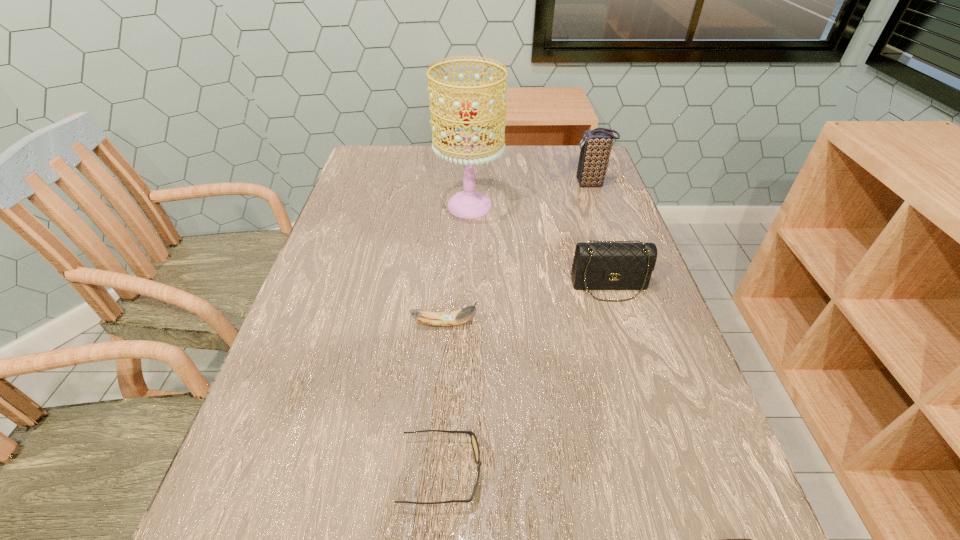
Identify which object is the fifth closest to the alarm clock. Please provide its 2D coordinates. Your answer should be formatted as a tuple, i.e. [(x, y)], where the tuple contains the x and y coordinates of a point satisfying the conditions above.

[(596, 146)]

The height and width of the screenshot is (540, 960). Identify the location of free space that satisfies the following two spatial constraints: 1. with the zip open on the farther clutch bag; 2. on the front flap of the shorter clutch bag. (627, 286).

What are the coordinates of `vacant space that satisfies the following two spatial constraints: 1. with the zip open on the fifth shortest object; 2. on the front flap of the third farthest object` in the screenshot? It's located at (627, 286).

Identify the location of free region that satisfies the following two spatial constraints: 1. on the front flap of the shorter clutch bag; 2. at the stem of the banana. (621, 323).